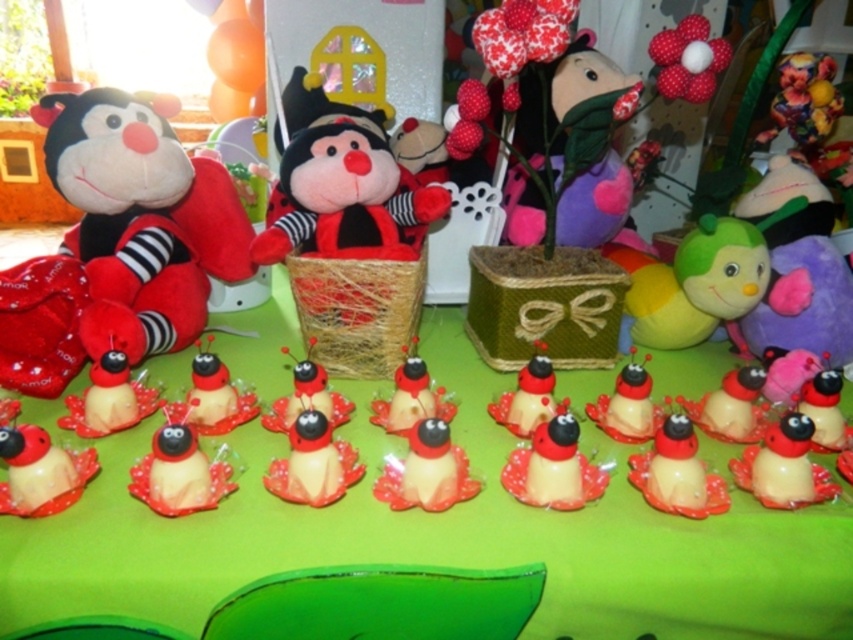
You are setting up for a childrens party and need to place both the green matte table at center and the plush toy at center on a shelf that can only hold items up to 1 meter in height. According to the scene description, which item might not fit on the shelf?

The green matte table at center is much taller than the plush toy at center, so the green matte table at center might not fit on the shelf if it exceeds the 1 meter height limit.

You are holding a ruler that is 24 inches long. You want to measure the distance from your current position to the point at coordinates point [793,529]. Can your ruler reach that point?

The distance between you and the point [793,529] is 25.62 inches. Since your ruler is only 24 inches long, it cannot reach the point.

You are setting up for a children party and need to place a small decoration on the green matte table at center. However, you notice the soft plush toy at left is in the way. Can you place the decoration on the table without moving the plush toy?

The green matte table at center is not as tall as the soft plush toy at left, so the plush toy is taller. Since the plush toy is taller, it might block access to the table, making it difficult to place the decoration without moving it.